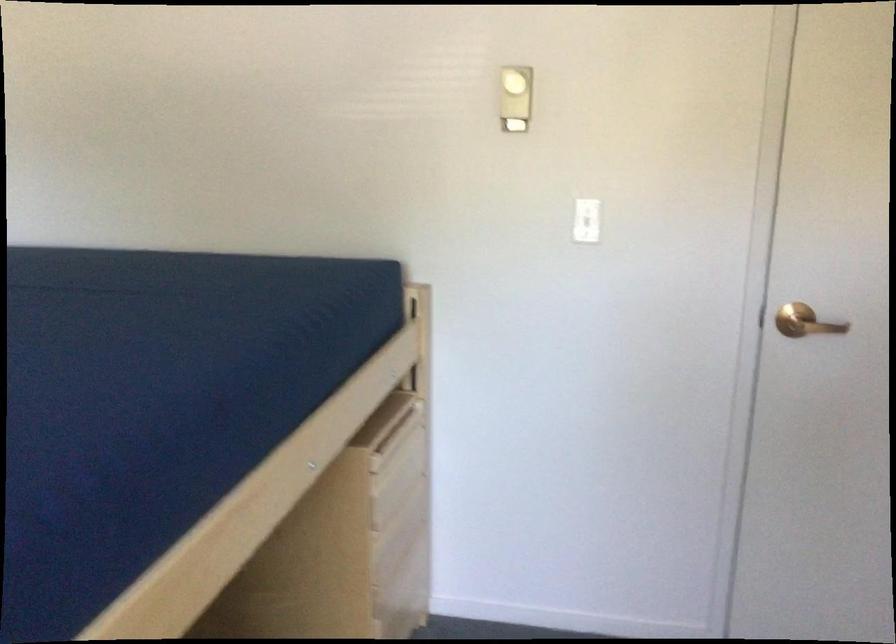
Where would you push the gold door handle? Please return your answer as a coordinate pair (x, y).

(805, 322)